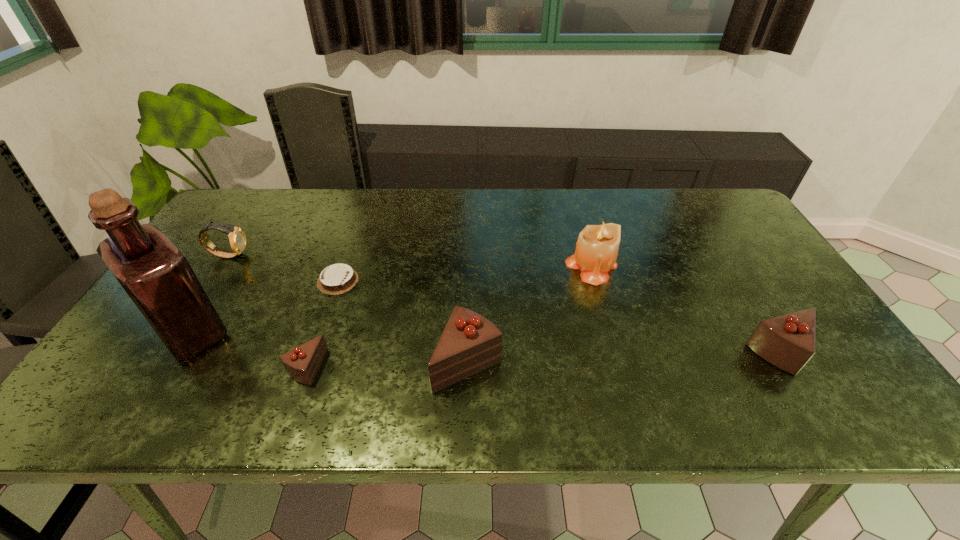
In order to click on the second shortest chocolate cake in this screenshot , I will do `click(302, 363)`.

I want to click on the fifth object from left to right, so click(x=470, y=343).

The width and height of the screenshot is (960, 540). What are the coordinates of `the second tallest chocolate cake` in the screenshot? It's located at (788, 342).

You are a GUI agent. You are given a task and a screenshot of the screen. Output one action in this format:
    pyautogui.click(x=<x>, y=<y>)
    Task: Click on the rightmost chocolate cake
    This screenshot has width=960, height=540.
    Given the screenshot: What is the action you would take?
    pyautogui.click(x=788, y=342)

Locate an element on the screen. The width and height of the screenshot is (960, 540). the shortest object is located at coordinates (338, 278).

Image resolution: width=960 pixels, height=540 pixels. I want to click on the farthest chocolate cake, so click(x=338, y=278).

You are a GUI agent. You are given a task and a screenshot of the screen. Output one action in this format:
    pyautogui.click(x=<x>, y=<y>)
    Task: Click on the watch
    Image resolution: width=960 pixels, height=540 pixels.
    Given the screenshot: What is the action you would take?
    pyautogui.click(x=237, y=238)

At what (x,y) coordinates should I click in order to perform the action: click on candle. Please return your answer as a coordinate pair (x, y). This screenshot has width=960, height=540. Looking at the image, I should click on (596, 251).

This screenshot has width=960, height=540. Find the location of `the sixth object from left to right`. the sixth object from left to right is located at coordinates (596, 251).

Image resolution: width=960 pixels, height=540 pixels. Identify the location of liquor. (157, 277).